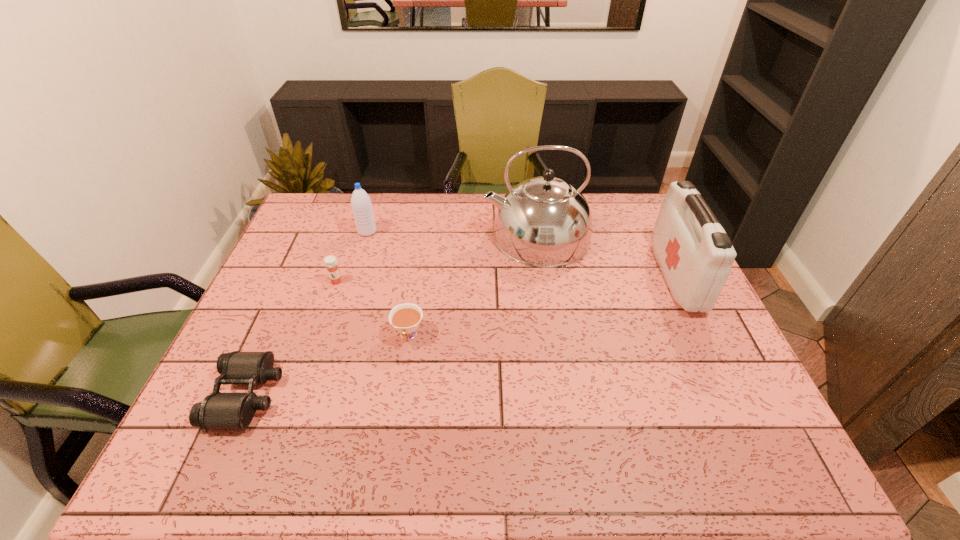
Identify the location of blank space located from the spout of the tallest object. (429, 235).

Where is `blank space located 0.200m from the spout of the tallest object`? blank space located 0.200m from the spout of the tallest object is located at coordinates (423, 235).

This screenshot has height=540, width=960. Find the location of `vacant space located from the spout of the tallest object`. vacant space located from the spout of the tallest object is located at coordinates (435, 235).

In order to click on vacant space located 0.060m on the front side of the first-aid kit in this screenshot , I will do `click(642, 277)`.

This screenshot has width=960, height=540. Find the location of `vacant region located 0.130m on the front side of the first-aid kit`. vacant region located 0.130m on the front side of the first-aid kit is located at coordinates (619, 277).

Where is `vacant area situated on the front side of the first-aid kit`? The image size is (960, 540). vacant area situated on the front side of the first-aid kit is located at coordinates (572, 277).

Locate an element on the screen. The height and width of the screenshot is (540, 960). free space located 0.160m on the right of the water bottle is located at coordinates (424, 232).

At what (x,y) coordinates should I click in order to perform the action: click on vacant point located 0.150m on the label side of the medicine. Please return your answer as a coordinate pair (x, y). The height and width of the screenshot is (540, 960). Looking at the image, I should click on (322, 325).

I want to click on vacant space located 0.070m on the side of the second nearest object with the handle, so click(402, 374).

Image resolution: width=960 pixels, height=540 pixels. Identify the location of free spot located through the eyepieces of the nearest object. (317, 395).